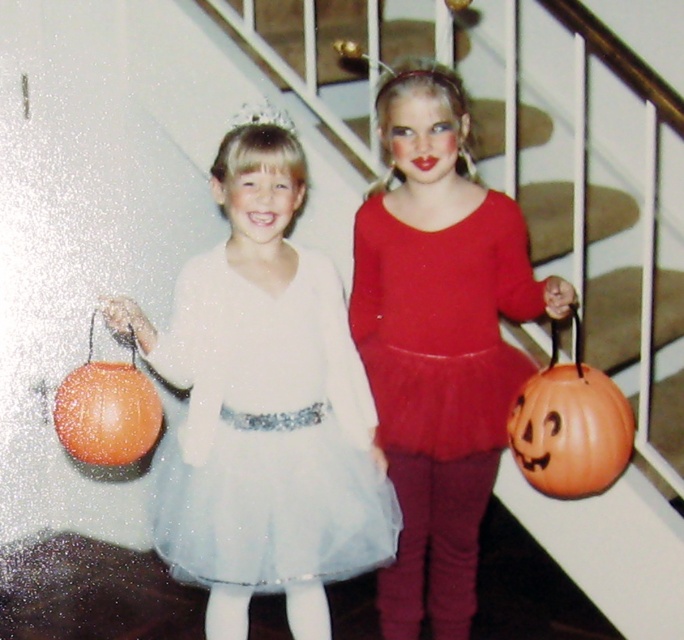
Two girls are standing in a house. The girl on the left holds an orange pumpkin bucket. The girl on the right wears a red tutu. A point is marked at (306,417). If you are standing at that point, can you see both girls clearly?

Yes, because the point is between them and they are 8.04 feet apart, so the distance allows clear visibility of both girls.